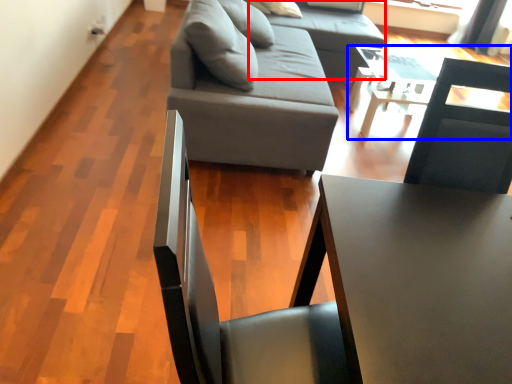
Question: Which object appears farthest to the camera in this image, couch (highlighted by a red box) or table (highlighted by a blue box)?

Choices:
 (A) couch
 (B) table

Answer: (A)